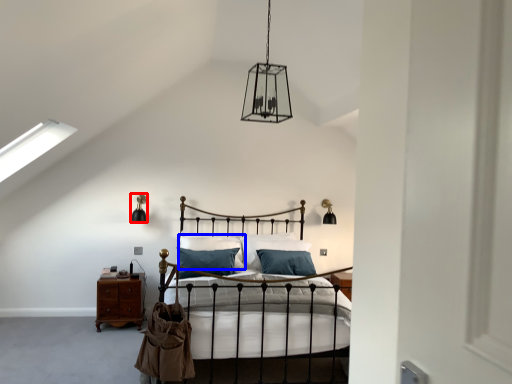
Question: Which point is closer to the camera, light fixture (highlighted by a red box) or pillow (highlighted by a blue box)?

Choices:
 (A) light fixture
 (B) pillow

Answer: (B)